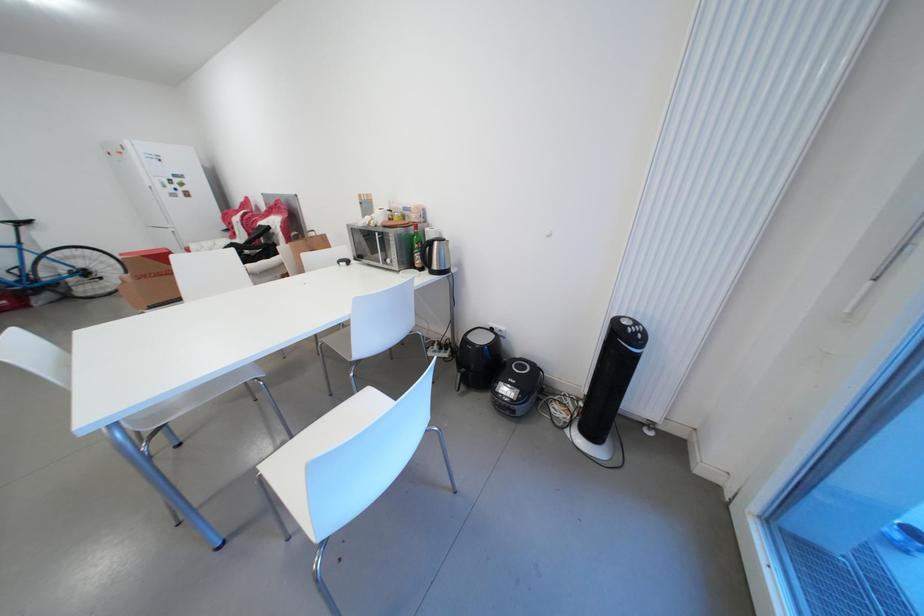
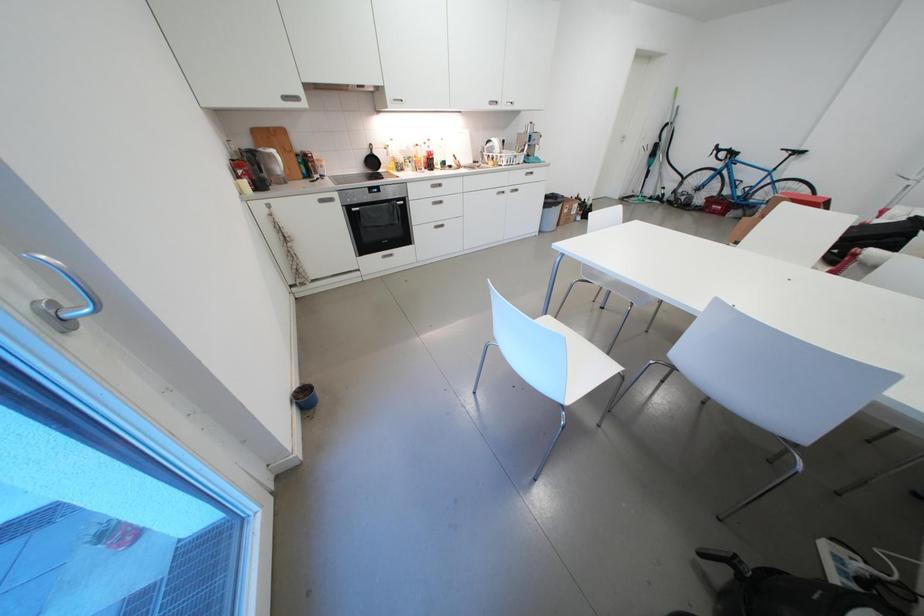
How did the camera likely rotate?

The camera's rotation is toward left-down.